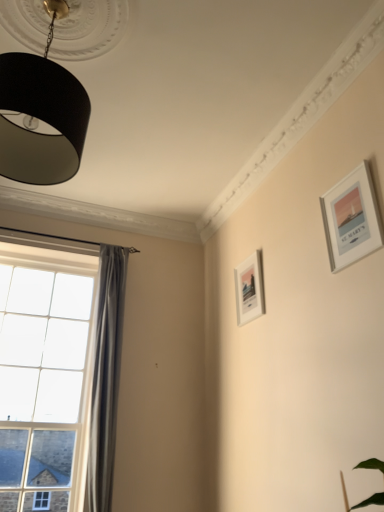
Question: Is satin grey curtain at left thinner than clear glass window at left?

Choices:
 (A) yes
 (B) no

Answer: (B)

Question: From a real-world perspective, is satin grey curtain at left physically below clear glass window at left?

Choices:
 (A) no
 (B) yes

Answer: (A)

Question: Is satin grey curtain at left oriented towards clear glass window at left?

Choices:
 (A) yes
 (B) no

Answer: (B)

Question: From a real-world perspective, is satin grey curtain at left on clear glass window at left?

Choices:
 (A) no
 (B) yes

Answer: (B)

Question: Is satin grey curtain at left wider than clear glass window at left?

Choices:
 (A) yes
 (B) no

Answer: (A)

Question: Considering the positions of silver metallic picture frame at upper right, the second picture frame in the back-to-front sequence, and satin grey curtain at left in the image, is silver metallic picture frame at upper right, the second picture frame in the back-to-front sequence, wider or thinner than satin grey curtain at left?

Choices:
 (A) wide
 (B) thin

Answer: (B)

Question: In terms of height, does silver metallic picture frame at upper right, placed as the 2th picture frame when sorted from left to right, look taller or shorter compared to satin grey curtain at left?

Choices:
 (A) short
 (B) tall

Answer: (A)

Question: In terms of size, does silver metallic picture frame at upper right, the second picture frame in the back-to-front sequence, appear bigger or smaller than satin grey curtain at left?

Choices:
 (A) big
 (B) small

Answer: (B)

Question: Visually, is silver metallic picture frame at upper right, placed as the 2th picture frame when sorted from left to right, positioned to the left or to the right of satin grey curtain at left?

Choices:
 (A) right
 (B) left

Answer: (A)

Question: From the image's perspective, relative to black matte lampshade at upper left, is white matte picture frame at center-right, which ranks as the first picture frame in bottom-to-top order, above or below?

Choices:
 (A) above
 (B) below

Answer: (B)

Question: Considering their positions, is white matte picture frame at center-right, which ranks as the first picture frame in bottom-to-top order, located in front of or behind black matte lampshade at upper left?

Choices:
 (A) behind
 (B) front

Answer: (A)

Question: From their relative heights in the image, would you say white matte picture frame at center-right, which is counted as the second picture frame, starting from the top, is taller or shorter than black matte lampshade at upper left?

Choices:
 (A) tall
 (B) short

Answer: (B)

Question: Is white matte picture frame at center-right, positioned as the first picture frame in left-to-right order, situated inside black matte lampshade at upper left or outside?

Choices:
 (A) outside
 (B) inside

Answer: (A)

Question: Considering the positions of point (110, 411) and point (362, 214), is point (110, 411) closer or farther from the camera than point (362, 214)?

Choices:
 (A) closer
 (B) farther

Answer: (B)

Question: From a real-world perspective, relative to silver metallic picture frame at upper right, the first picture frame in the right-to-left sequence, is satin grey curtain at left vertically above or below?

Choices:
 (A) above
 (B) below

Answer: (B)